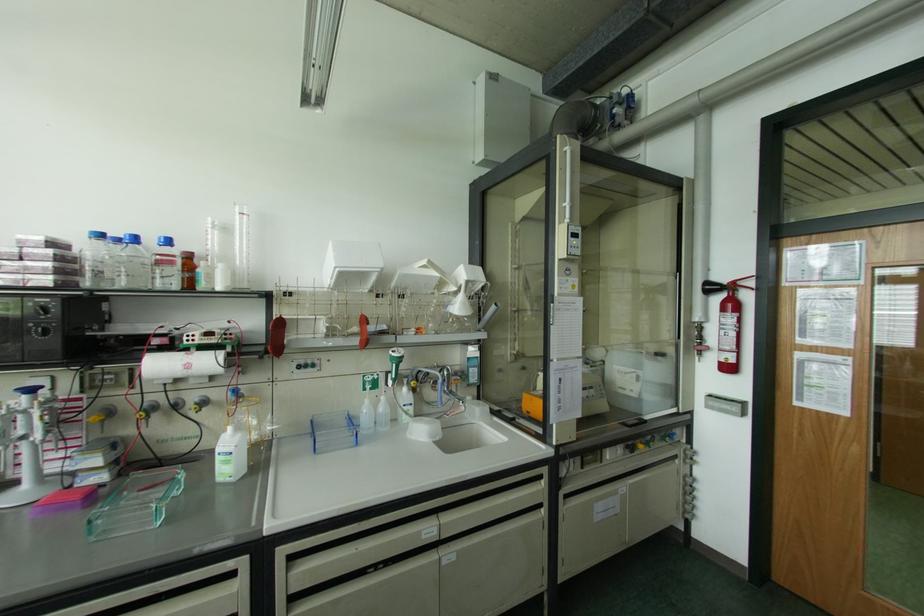
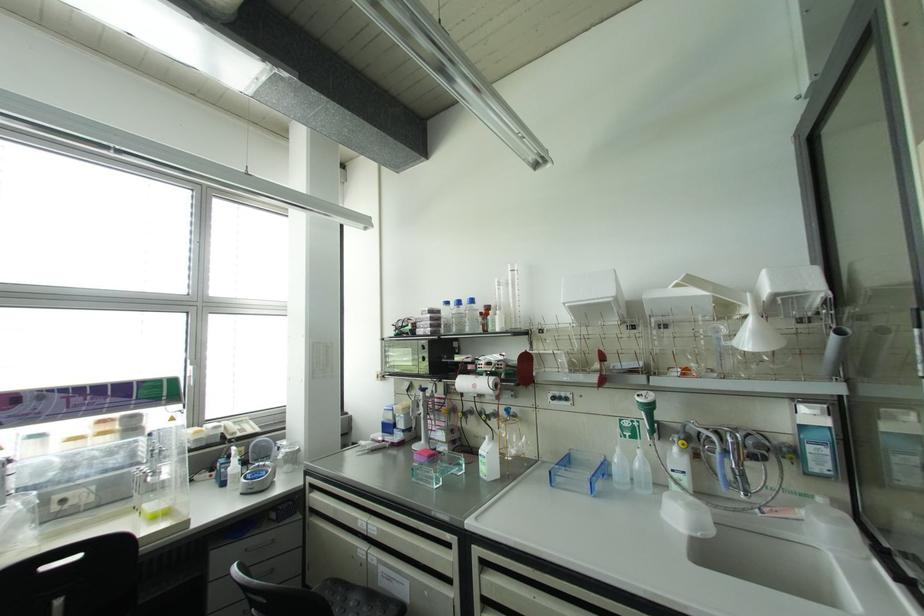
Where in the second image is the point corresponding to point (225, 229) from the first image?

(506, 284)